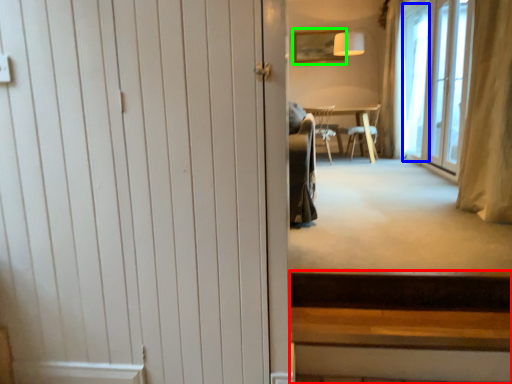
Question: Which object is the farthest from stairs (highlighted by a red box)? Choose among these: window screen (highlighted by a blue box) or picture frame (highlighted by a green box).

Choices:
 (A) window screen
 (B) picture frame

Answer: (B)